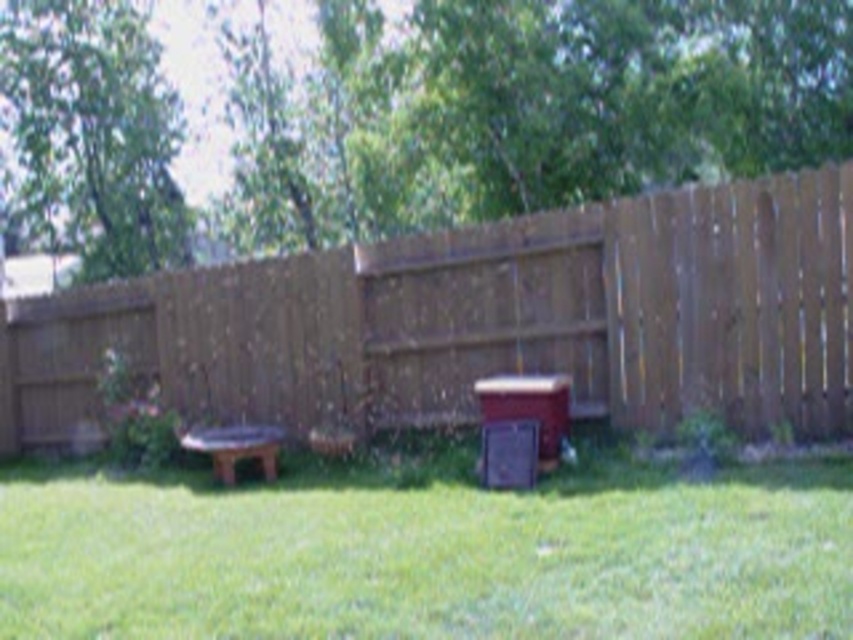
Question: Considering the real-world distances, which object is farthest from the brown wooden picnic table at center?

Choices:
 (A) brown wooden fence at center
 (B) green grass at lower center

Answer: (B)

Question: From the image, what is the correct spatial relationship of green grass at lower center in relation to brown wooden picnic table at center?

Choices:
 (A) right
 (B) left

Answer: (A)

Question: Can you confirm if brown wooden fence at center is bigger than brown wooden picnic table at center?

Choices:
 (A) yes
 (B) no

Answer: (A)

Question: Among these objects, which one is farthest from the camera?

Choices:
 (A) green grass at lower center
 (B) brown wooden fence at center

Answer: (B)

Question: Is the position of brown wooden fence at center less distant than that of green grass at lower center?

Choices:
 (A) yes
 (B) no

Answer: (B)

Question: Which point appears closest to the camera in this image?

Choices:
 (A) (193, 444)
 (B) (422, 589)
 (C) (456, 244)

Answer: (B)